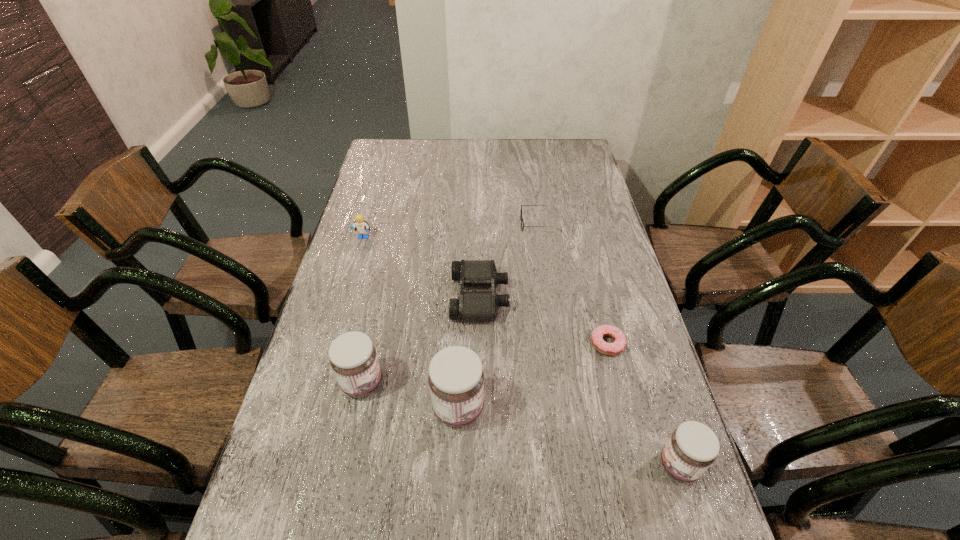
Where is `the fourth closest object to the fifth object from left to right`? The width and height of the screenshot is (960, 540). the fourth closest object to the fifth object from left to right is located at coordinates [x=456, y=378].

Find the location of a particular element. Image resolution: width=960 pixels, height=540 pixels. the second closest object to the sixth shortest object is located at coordinates (471, 306).

Image resolution: width=960 pixels, height=540 pixels. I want to click on the second closest jam to the shortest object, so click(456, 378).

The height and width of the screenshot is (540, 960). I want to click on jam that stands as the closest to the second tallest object, so click(x=456, y=378).

I want to click on vacant space that satisfies the following two spatial constraints: 1. through the lenses of the sixth tallest object; 2. on the front-facing side of the fourth tallest object, so click(x=542, y=238).

Locate an element on the screen. Image resolution: width=960 pixels, height=540 pixels. vacant area in the image that satisfies the following two spatial constraints: 1. through the eyepieces of the fourth nearest object; 2. on the right side of the binoculars is located at coordinates (480, 344).

Locate an element on the screen. free space that satisfies the following two spatial constraints: 1. on the front side of the fourth nearest object; 2. on the front label of the second jam from right to left is located at coordinates (624, 408).

At what (x,y) coordinates should I click in order to perform the action: click on free space that satisfies the following two spatial constraints: 1. through the eyepieces of the fifth tallest object; 2. on the back side of the fourth nearest object. Please return your answer as a coordinate pair (x, y). Looking at the image, I should click on (480, 344).

The height and width of the screenshot is (540, 960). I want to click on vacant space that satisfies the following two spatial constraints: 1. on the back side of the shortest object; 2. through the lenses of the second shortest object, so click(x=578, y=224).

Find the location of a particular element. The image size is (960, 540). free point that satisfies the following two spatial constraints: 1. on the front-facing side of the fourth farthest object; 2. on the right side of the leftmost object is located at coordinates (332, 344).